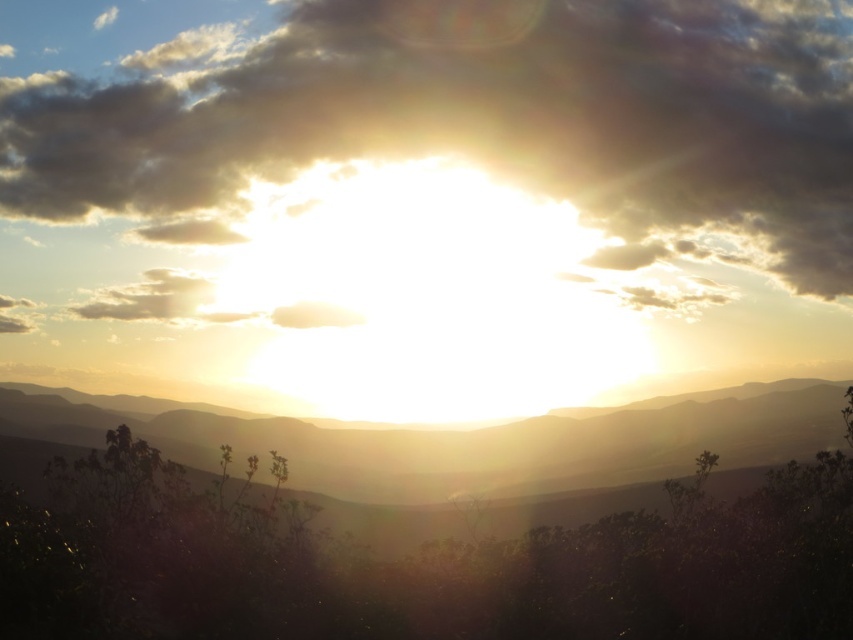
Can you confirm if cloudy sky at upper center is taller than silhouetted rock formation at center?

Correct, cloudy sky at upper center is much taller as silhouetted rock formation at center.

Describe the element at coordinates (474, 120) in the screenshot. This screenshot has width=853, height=640. I see `cloudy sky at upper center` at that location.

The image size is (853, 640). Find the location of `cloudy sky at upper center`. cloudy sky at upper center is located at coordinates (474, 120).